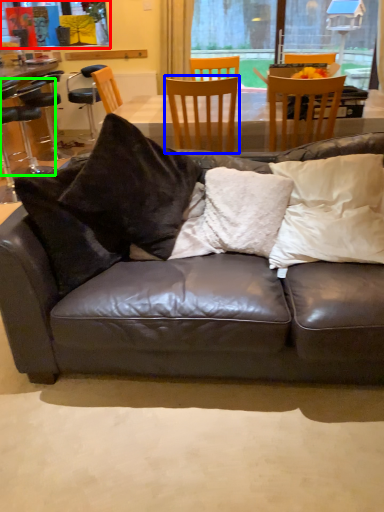
Question: Which object is the closest to the window screen (highlighted by a red box)? Choose among these: chair (highlighted by a blue box) or chair (highlighted by a green box).

Choices:
 (A) chair
 (B) chair

Answer: (B)